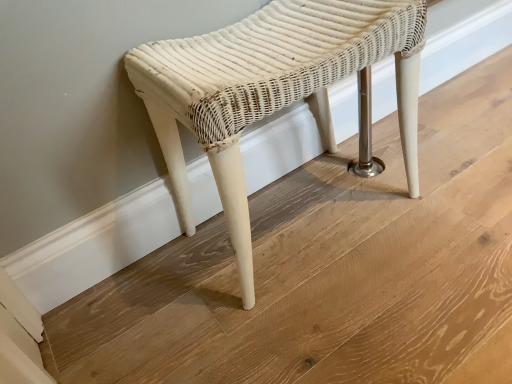
The height and width of the screenshot is (384, 512). Find the location of `free point below white wicker stool at center (from a real-world perspective)`. free point below white wicker stool at center (from a real-world perspective) is located at coordinates (302, 217).